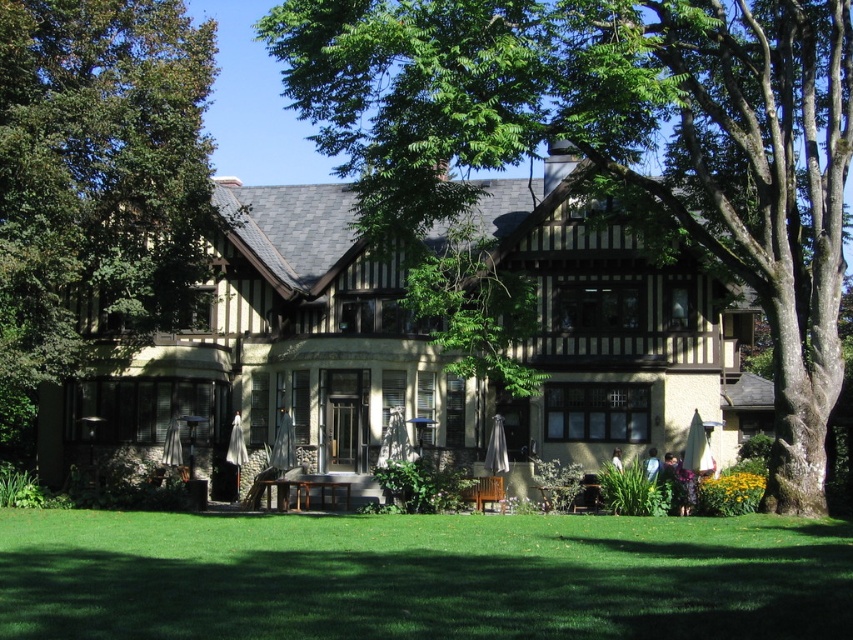
Which of these two, green leafy tree at center or green grass at lower center, stands taller?

With more height is green leafy tree at center.

Which is in front, point (763, 196) or point (724, 589)?

Positioned in front is point (724, 589).

Does point (677, 19) lie behind point (618, 545)?

Yes, point (677, 19) is farther from viewer.

Identify the location of green leafy tree at center. (618, 141).

Image resolution: width=853 pixels, height=640 pixels. Describe the element at coordinates (421, 577) in the screenshot. I see `green grass at lower center` at that location.

Identify the location of green grass at lower center. The height and width of the screenshot is (640, 853). (421, 577).

Does point (474, 577) come behind point (144, 1)?

No.

Find the location of a particular element. This screenshot has height=640, width=853. green grass at lower center is located at coordinates (421, 577).

Does green leafy tree at center appear on the left side of green leafy tree at left?

In fact, green leafy tree at center is to the right of green leafy tree at left.

Which of these two, green leafy tree at center or green leafy tree at left, stands taller?

Standing taller between the two is green leafy tree at left.

The image size is (853, 640). I want to click on green leafy tree at center, so click(618, 141).